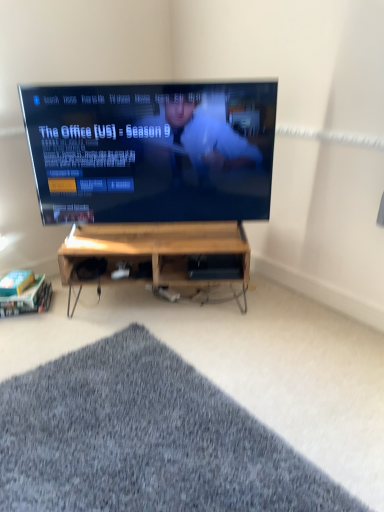
Question: Visually, is black glossy tv at center positioned to the left or to the right of woodenmaterial/textureshelf at lower left, acting as the second shelf starting from the top?

Choices:
 (A) right
 (B) left

Answer: (A)

Question: In terms of size, does black glossy tv at center appear bigger or smaller than woodenmaterial/textureshelf at lower left, positioned as the 2th shelf in right-to-left order?

Choices:
 (A) big
 (B) small

Answer: (A)

Question: Estimate the real-world distances between objects in this image. Which object is farther from the black glossy tv at center?

Choices:
 (A) wooden at center, positioned as the first shelf in top-to-bottom order
 (B) gray shaggy rug at lower center
 (C) woodenmaterial/texturedesk at center
 (D) woodenmaterial/textureshelf at lower left, positioned as the 2th shelf in right-to-left order

Answer: (B)

Question: Which of these objects is positioned closest to the woodenmaterial/texturedesk at center?

Choices:
 (A) black glossy tv at center
 (B) gray shaggy rug at lower center
 (C) wooden at center, acting as the second shelf starting from the bottom
 (D) woodenmaterial/textureshelf at lower left, positioned as the 2th shelf in right-to-left order

Answer: (C)